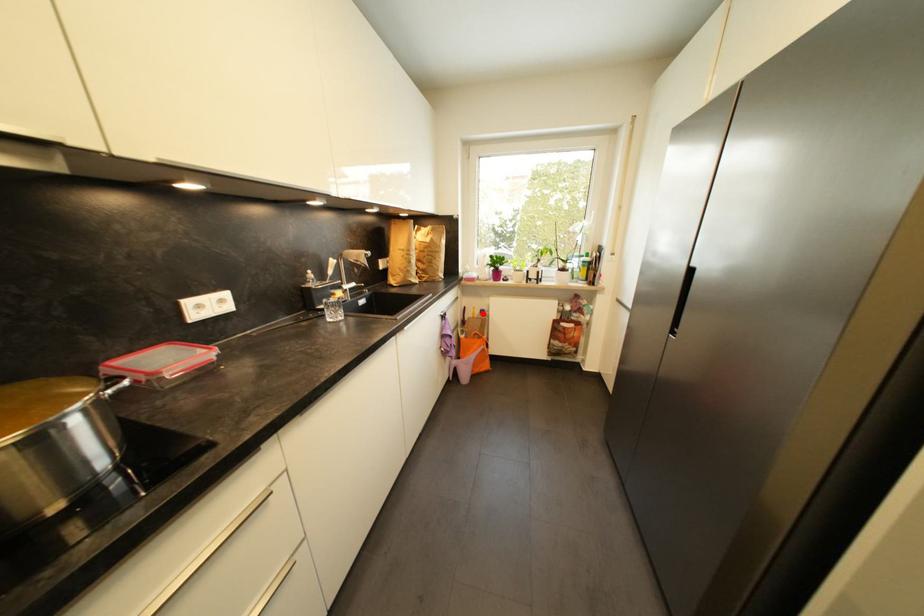
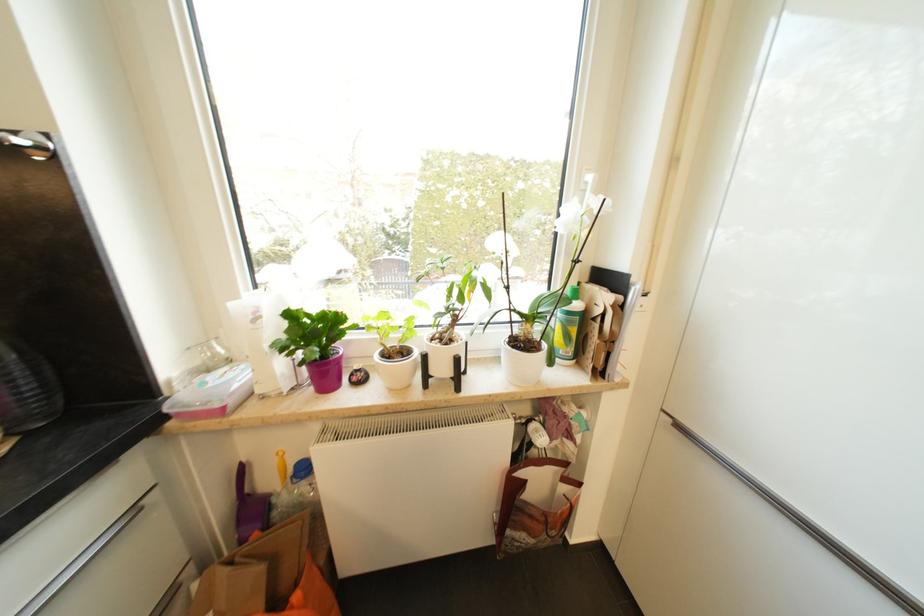
Question: I am providing you with two images of the same scene from different viewpoints. In image1, a red point is highlighted. Considering the same 3D point in image2, which of the following is correct?

Choices:
 (A) It is closer
 (B) It is farther

Answer: (B)